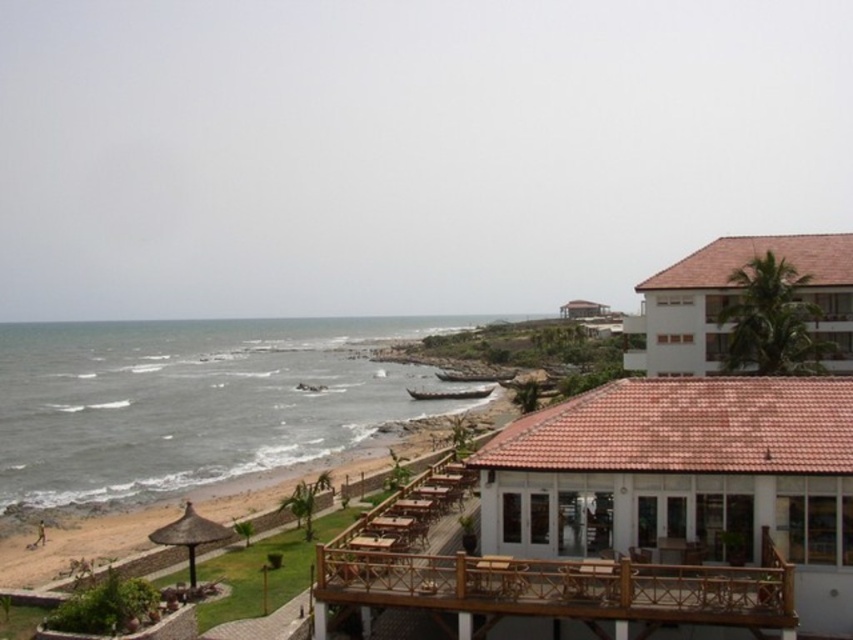
Question: Can you confirm if gray water at lower left is thinner than wooden at lower right?

Choices:
 (A) no
 (B) yes

Answer: (A)

Question: Is white matte building at right wider than smooth sand beach at lower left?

Choices:
 (A) yes
 (B) no

Answer: (B)

Question: Which point is closer to the camera?

Choices:
 (A) (209, 448)
 (B) (525, 614)
 (C) (555, 518)
 (D) (801, 257)

Answer: (B)

Question: Which point appears closest to the camera in this image?

Choices:
 (A) (103, 397)
 (B) (660, 564)
 (C) (242, 499)

Answer: (B)

Question: Is wooden at lower right in front of white matte building at right?

Choices:
 (A) no
 (B) yes

Answer: (B)

Question: Which of the following is the farthest from the observer?

Choices:
 (A) (833, 269)
 (B) (682, 605)

Answer: (A)